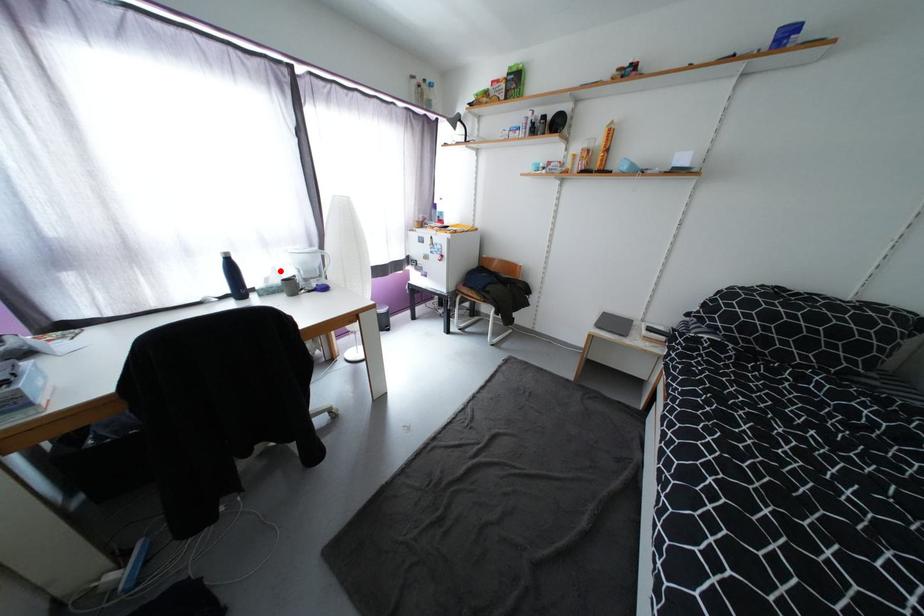
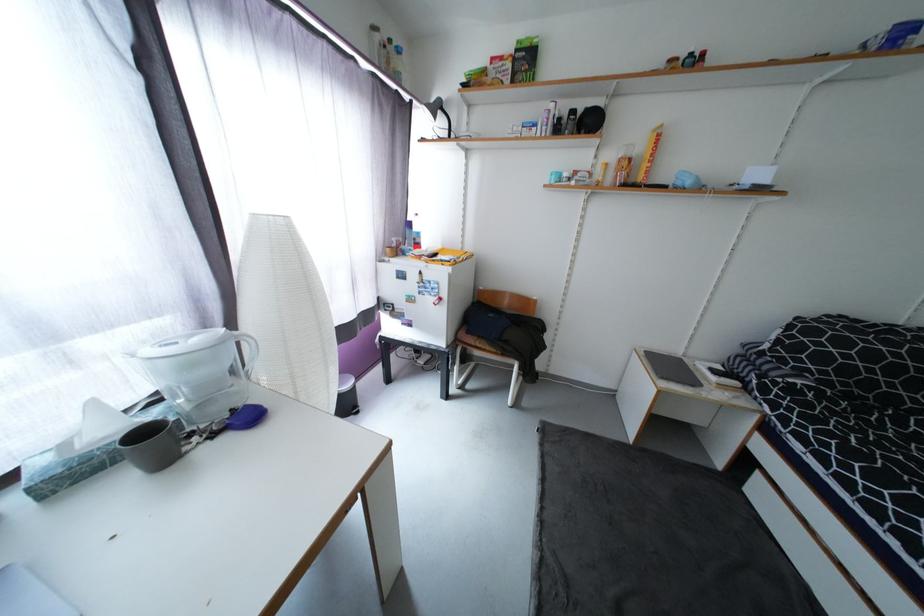
Find the pixel in the second image that matches the highlighted location in the first image.

(102, 407)